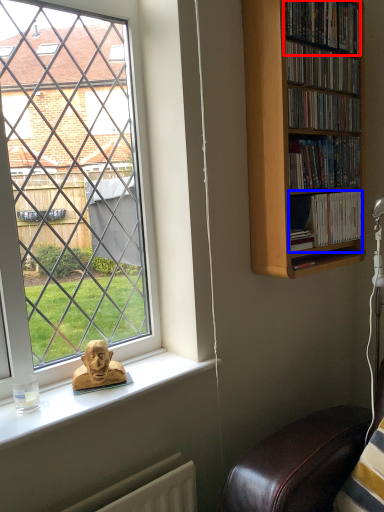
Question: Which point is closer to the camera, book (highlighted by a red box) or book (highlighted by a blue box)?

Choices:
 (A) book
 (B) book

Answer: (A)